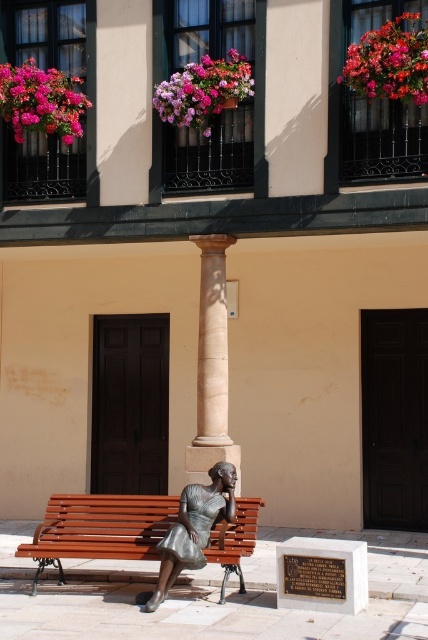
Question: Does pink fabric flower at upper right have a smaller size compared to pink fabric flowers at upper center?

Choices:
 (A) no
 (B) yes

Answer: (B)

Question: Among these objects, which one is farthest from the camera?

Choices:
 (A) bronze statue at center
 (B) beige marble column at center
 (C) pink fabric flowers at upper left
 (D) pink fabric flowers at upper center

Answer: (C)

Question: Which object is the farthest from the wooden bench at center?

Choices:
 (A) pink fabric flowers at upper center
 (B) beige marble column at center
 (C) pink fabric flowers at upper left

Answer: (C)

Question: Does pink fabric flower at upper right appear on the right side of bronze statue at center?

Choices:
 (A) no
 (B) yes

Answer: (B)

Question: Is wooden bench at center below bronze statue at center?

Choices:
 (A) yes
 (B) no

Answer: (A)

Question: Which of these objects is positioned farthest from the pink fabric flowers at upper center?

Choices:
 (A) bronze statue at center
 (B) pink fabric flowers at upper left
 (C) pink fabric flower at upper right

Answer: (A)